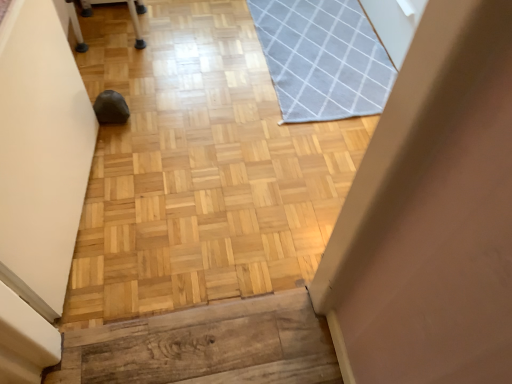
Question: From the image's perspective, is gray woven mat at upper right below matte white plastic chair at upper left?

Choices:
 (A) yes
 (B) no

Answer: (A)

Question: Is gray woven mat at upper right closer to camera compared to matte white plastic chair at upper left?

Choices:
 (A) yes
 (B) no

Answer: (A)

Question: Is gray woven mat at upper right shorter than matte white plastic chair at upper left?

Choices:
 (A) yes
 (B) no

Answer: (A)

Question: From the image's perspective, does gray woven mat at upper right appear higher than matte white plastic chair at upper left?

Choices:
 (A) no
 (B) yes

Answer: (A)

Question: Considering the relative positions of gray woven mat at upper right and matte white plastic chair at upper left in the image provided, is gray woven mat at upper right to the left of matte white plastic chair at upper left from the viewer's perspective?

Choices:
 (A) no
 (B) yes

Answer: (A)

Question: Considering the relative positions of gray woven mat at upper right and matte white plastic chair at upper left in the image provided, is gray woven mat at upper right to the right of matte white plastic chair at upper left from the viewer's perspective?

Choices:
 (A) no
 (B) yes

Answer: (B)

Question: From a real-world perspective, does matte white plastic chair at upper left sit lower than gray woven mat at upper right?

Choices:
 (A) no
 (B) yes

Answer: (A)

Question: From the image's perspective, is matte white plastic chair at upper left on gray woven mat at upper right?

Choices:
 (A) no
 (B) yes

Answer: (B)

Question: Does matte white plastic chair at upper left come in front of gray woven mat at upper right?

Choices:
 (A) no
 (B) yes

Answer: (A)

Question: From the image's perspective, is matte white plastic chair at upper left under gray woven mat at upper right?

Choices:
 (A) yes
 (B) no

Answer: (B)

Question: Is gray woven mat at upper right at the back of matte white plastic chair at upper left?

Choices:
 (A) yes
 (B) no

Answer: (B)

Question: Considering the relative sizes of matte white plastic chair at upper left and gray woven mat at upper right in the image provided, is matte white plastic chair at upper left shorter than gray woven mat at upper right?

Choices:
 (A) yes
 (B) no

Answer: (B)

Question: From their relative heights in the image, would you say matte white plastic chair at upper left is taller or shorter than gray woven mat at upper right?

Choices:
 (A) tall
 (B) short

Answer: (A)